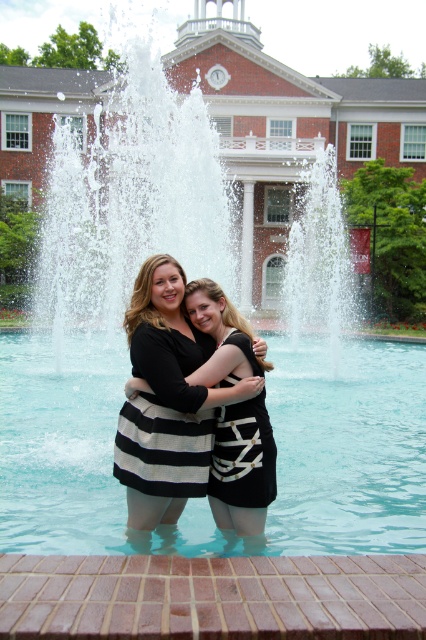
Question: Which of these objects is positioned closest to the black striped dress at center?

Choices:
 (A) clear blue water at center
 (B) black matte dress at center

Answer: (B)

Question: Which point is farther to the camera?

Choices:
 (A) (380, 394)
 (B) (138, 280)
 (C) (180, 449)

Answer: (A)

Question: Observing the image, what is the correct spatial positioning of clear blue water at center in reference to black striped dress at center?

Choices:
 (A) right
 (B) left

Answer: (B)

Question: In this image, where is black striped dress at center located relative to black matte dress at center?

Choices:
 (A) below
 (B) above

Answer: (A)

Question: Among these objects, which one is farthest from the camera?

Choices:
 (A) black matte dress at center
 (B) black striped dress at center
 (C) clear blue water at center

Answer: (A)

Question: Is clear blue water at center bigger than black matte dress at center?

Choices:
 (A) yes
 (B) no

Answer: (A)